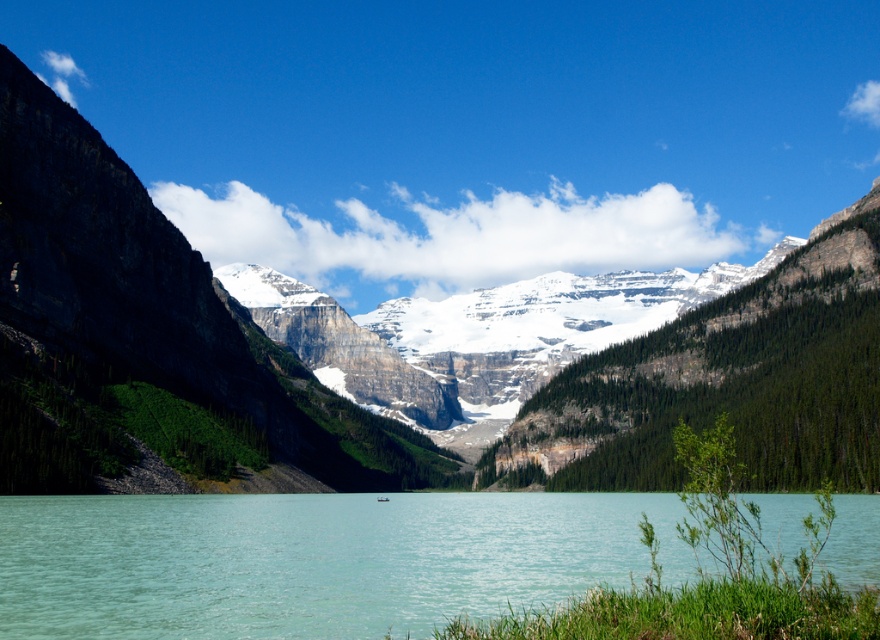
You are a hiker planning to cross the lake using a small boat. You notice two points marked on your map at coordinates point (750, 388) and point (687, 545). According to the image, which point is closer to the mountains in the background?

Point (750, 388) is behind point (687, 545), so it is closer to the mountains in the background.